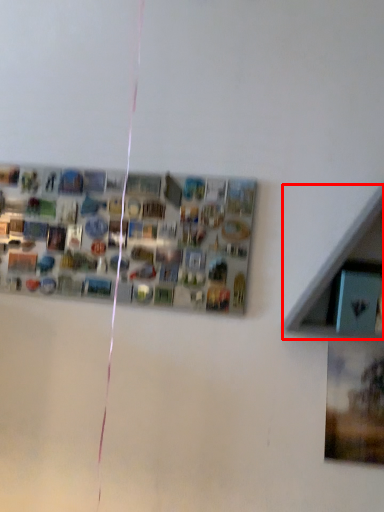
Question: In this image, where is shelf (annotated by the red box) located relative to bulletin board?

Choices:
 (A) left
 (B) right

Answer: (B)